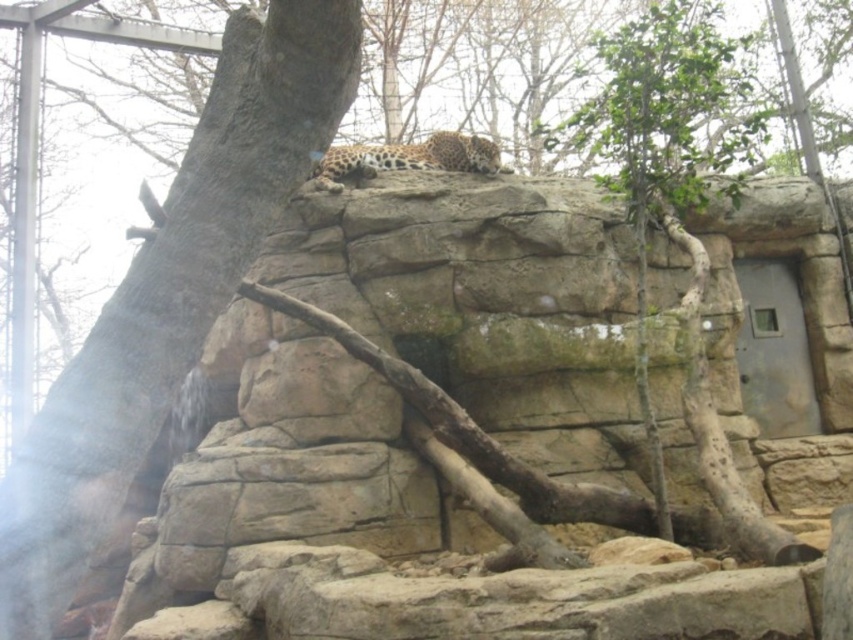
You are a zookeeper trying to locate a specific point in the leopard enclosure. The point you need to find is at coordinates point [170,296]. According to the scene description, where exactly is this point located?

The point [170,296] is on the smooth gray tree trunk at upper left.

You are a zookeeper standing at the entrance of the leopard enclosure. You notice a green leafy tree at upper right that you want to water. Given that your watering hose can reach up to 120 feet, will you be able to water the tree from your current position?

The green leafy tree at upper right is 126.33 feet away from the viewer. Since the watering hose can only reach up to 120 feet, you will not be able to water the tree from your current position.

You are a zookeeper observing the leopard enclosure. You notice the green leafy tree at upper right and the spotted fur leopard at upper center. Which object is taller in the enclosure?

The green leafy tree at upper right is much taller than the spotted fur leopard at upper center.